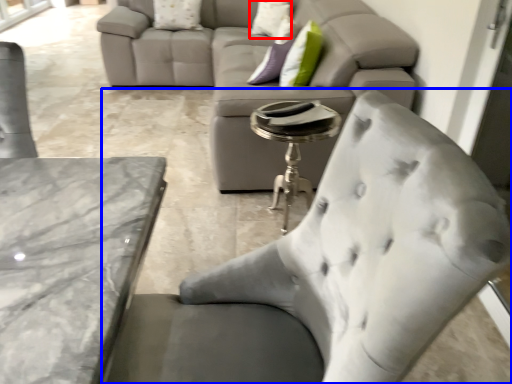
Question: Which point is further to the camera, pillow (highlighted by a red box) or chair (highlighted by a blue box)?

Choices:
 (A) pillow
 (B) chair

Answer: (A)